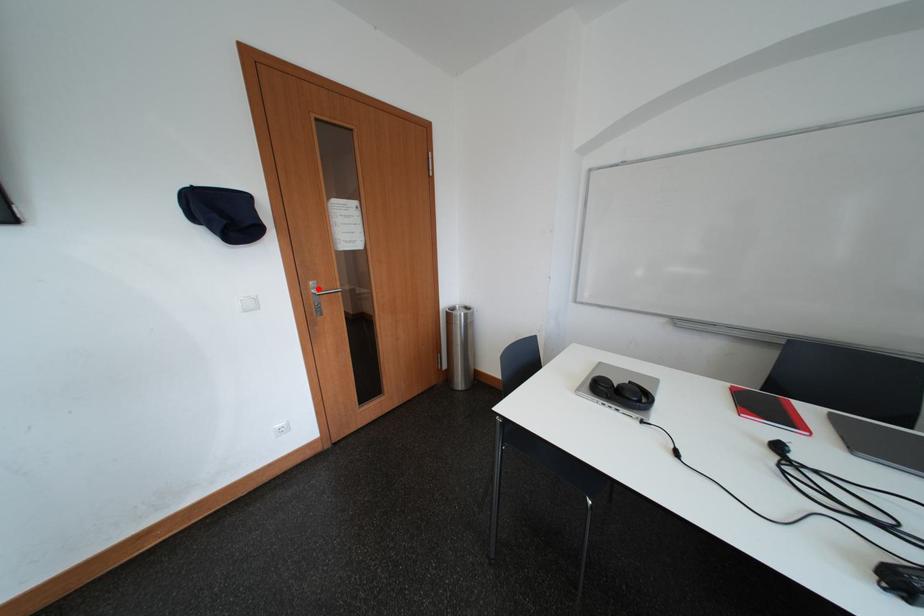
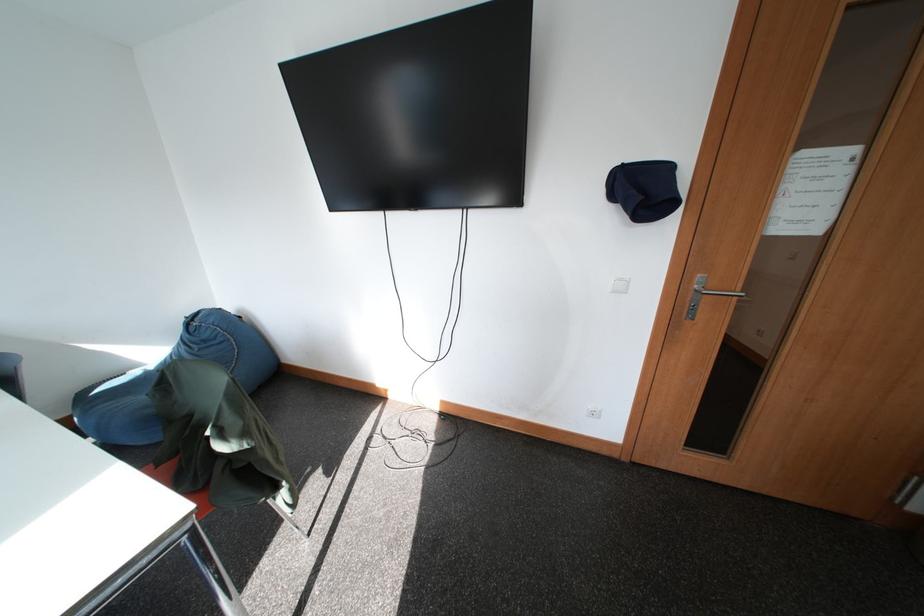
In the second image, find the point that corresponds to the highlighted location in the first image.

(703, 282)